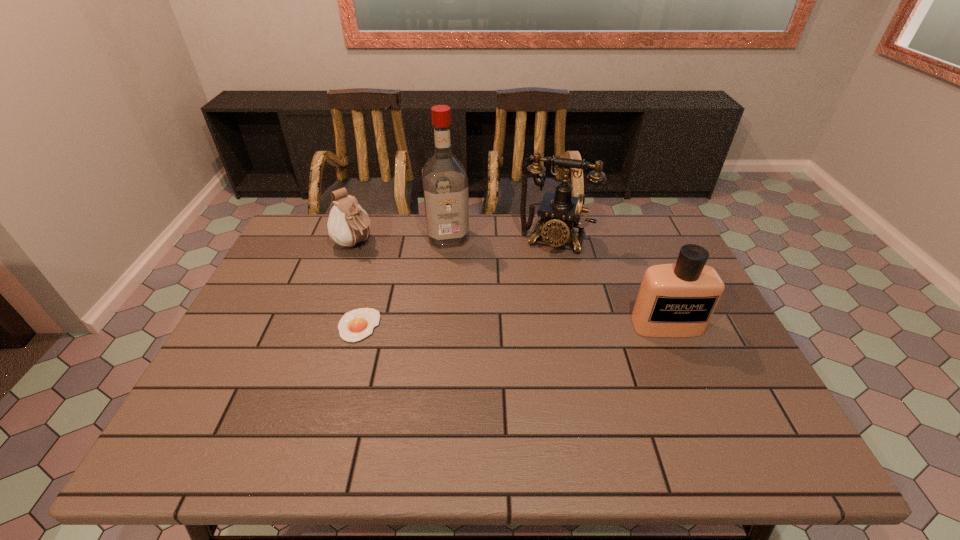
Find the location of a particular element. liquor that is at the far edge is located at coordinates (445, 184).

Locate an element on the screen. This screenshot has width=960, height=540. pouch situated at the far edge is located at coordinates (348, 224).

Where is `object present at the left edge`? The width and height of the screenshot is (960, 540). object present at the left edge is located at coordinates (348, 224).

Where is `object present at the right edge`? The image size is (960, 540). object present at the right edge is located at coordinates (678, 300).

The image size is (960, 540). Identify the location of object at the far left corner. (348, 224).

Locate an element on the screen. This screenshot has width=960, height=540. vacant space at the far edge of the desktop is located at coordinates (421, 256).

This screenshot has width=960, height=540. Find the location of `vacant space at the near edge of the desktop`. vacant space at the near edge of the desktop is located at coordinates (592, 406).

In the image, there is a desktop. Where is `free space at the left edge`? This screenshot has width=960, height=540. free space at the left edge is located at coordinates (243, 368).

Identify the location of free space at the right edge of the desktop. This screenshot has height=540, width=960. (646, 263).

Identify the location of free space at the far left corner of the desktop. The width and height of the screenshot is (960, 540). (326, 225).